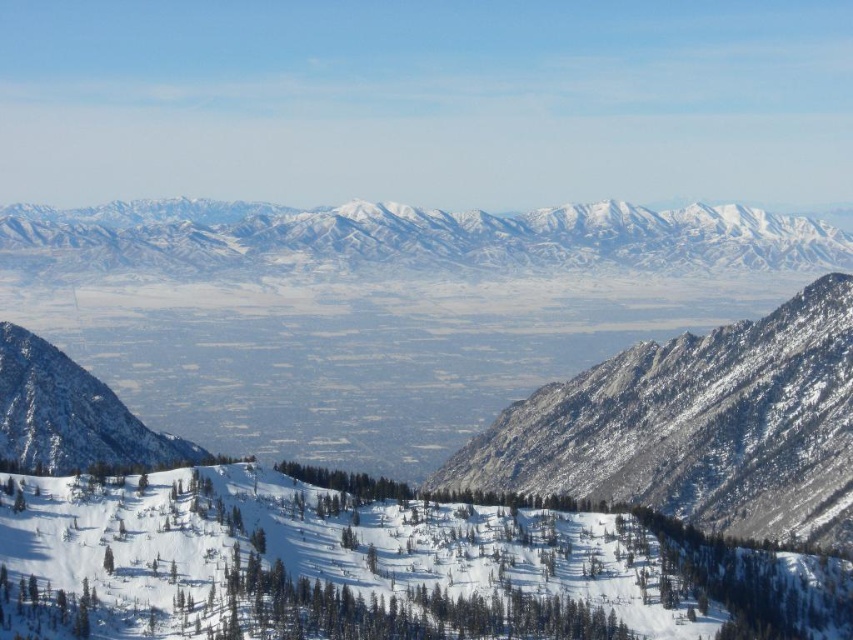
You are a hiker planning to take a photo of the snowy granite mountains at center and the snowy rocky mountain at left. From your current position, which mountain should you aim your camera upwards to capture?

The snowy granite mountains at center is located above the snowy rocky mountain at left, so you should aim your camera upwards to capture the snowy granite mountains at center.